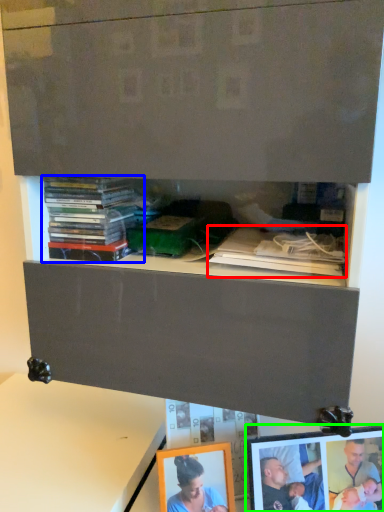
Question: Which object is positioned farthest from book (highlighted by a red box)? Select from book (highlighted by a blue box) and picture frame (highlighted by a green box).

Choices:
 (A) book
 (B) picture frame

Answer: (B)